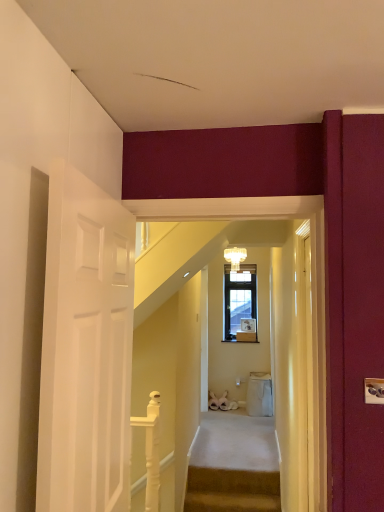
Question: Is crystal glass chandelier at upper center located outside white carpeted stairs at center, arranged as the 1th stairs when viewed from the top?

Choices:
 (A) no
 (B) yes

Answer: (B)

Question: Is crystal glass chandelier at upper center next to white carpeted stairs at center, arranged as the 1th stairs when viewed from the top, and touching it?

Choices:
 (A) no
 (B) yes

Answer: (A)

Question: Can you confirm if crystal glass chandelier at upper center is positioned to the right of white carpeted stairs at center, the first stairs when ordered from back to front?

Choices:
 (A) no
 (B) yes

Answer: (B)

Question: Is crystal glass chandelier at upper center looking in the opposite direction of white carpeted stairs at center, which is the 2th stairs in front-to-back order?

Choices:
 (A) yes
 (B) no

Answer: (B)

Question: Does crystal glass chandelier at upper center have a greater width compared to white carpeted stairs at center, arranged as the 1th stairs when viewed from the top?

Choices:
 (A) no
 (B) yes

Answer: (A)

Question: Is white carpeted stairs at center, arranged as the 1th stairs when viewed from the top, inside or outside of carpeted stairs at center, which is the second stairs in top-to-bottom order?

Choices:
 (A) outside
 (B) inside

Answer: (A)

Question: Is point (271, 503) closer or farther from the camera than point (228, 470)?

Choices:
 (A) farther
 (B) closer

Answer: (B)

Question: Considering the positions of white carpeted stairs at center, the 2th stairs in the bottom-to-top sequence, and carpeted stairs at center, the 1th stairs in the front-to-back sequence, in the image, is white carpeted stairs at center, the 2th stairs in the bottom-to-top sequence, wider or thinner than carpeted stairs at center, the 1th stairs in the front-to-back sequence,?

Choices:
 (A) wide
 (B) thin

Answer: (A)

Question: Is white carpeted stairs at center, the 2th stairs in the bottom-to-top sequence, bigger or smaller than carpeted stairs at center, positioned as the second stairs in back-to-front order?

Choices:
 (A) small
 (B) big

Answer: (B)

Question: Is point (266, 412) positioned closer to the camera than point (135, 420)?

Choices:
 (A) farther
 (B) closer

Answer: (A)

Question: In terms of width, does beige fabric trash bin at lower center look wider or thinner when compared to white glossy balustrade at lower center?

Choices:
 (A) thin
 (B) wide

Answer: (B)

Question: From a real-world perspective, is beige fabric trash bin at lower center physically located above or below white glossy balustrade at lower center?

Choices:
 (A) below
 (B) above

Answer: (A)

Question: Based on their positions, is beige fabric trash bin at lower center located to the left or right of white glossy balustrade at lower center?

Choices:
 (A) left
 (B) right

Answer: (B)

Question: Is carpeted stairs at center, positioned as the second stairs in back-to-front order, taller or shorter than beige fabric trash bin at lower center?

Choices:
 (A) tall
 (B) short

Answer: (B)

Question: Looking at their shapes, would you say carpeted stairs at center, positioned as the 1th stairs in bottom-to-top order, is wider or thinner than beige fabric trash bin at lower center?

Choices:
 (A) thin
 (B) wide

Answer: (A)